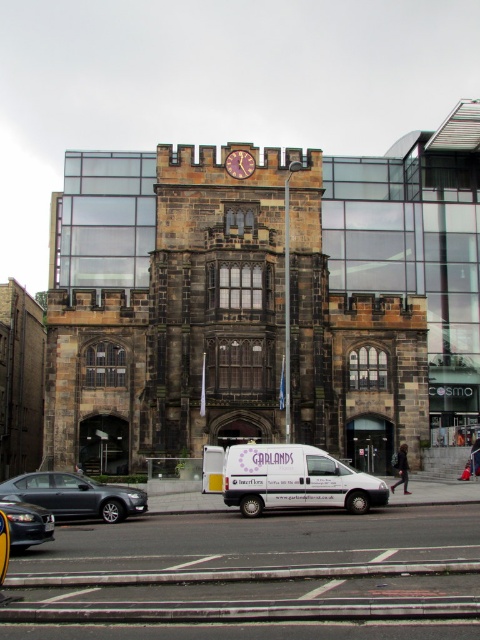
Question: Which point appears farthest from the camera in this image?

Choices:
 (A) (108, 490)
 (B) (285, 477)
 (C) (12, 509)

Answer: (B)

Question: Is white matte van at center behind metallic gray sedan at lower left?

Choices:
 (A) yes
 (B) no

Answer: (A)

Question: Which object is positioned closest to the white matte van at center?

Choices:
 (A) metallic gray sedan at lower left
 (B) shiny black car at lower left

Answer: (A)

Question: Does white matte van at center appear on the left side of metallic gray sedan at lower left?

Choices:
 (A) no
 (B) yes

Answer: (A)

Question: Can you confirm if white matte van at center is wider than shiny black car at lower left?

Choices:
 (A) yes
 (B) no

Answer: (A)

Question: Which point is closer to the camera?

Choices:
 (A) shiny black car at lower left
 (B) white matte van at center
 (C) metallic gray sedan at lower left

Answer: (A)